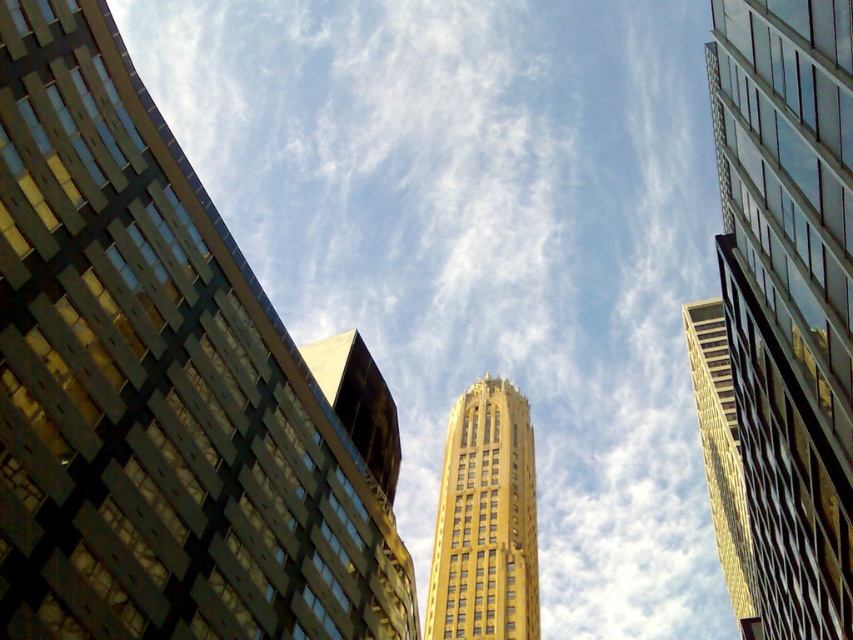
Does gold glass skyscraper at upper center come in front of gold glass skyscraper at center?

Yes.

Which is above, gold glass skyscraper at upper center or gold glass skyscraper at center?

gold glass skyscraper at upper center is higher up.

Where is `gold glass skyscraper at upper center`? The width and height of the screenshot is (853, 640). gold glass skyscraper at upper center is located at coordinates (788, 296).

Identify the location of golden glass skyscraper at center. (160, 387).

Is golden glass skyscraper at center taller than gold glass skyscraper at center?

Yes, golden glass skyscraper at center is taller than gold glass skyscraper at center.

Identify the location of golden glass skyscraper at center. The width and height of the screenshot is (853, 640). (160, 387).

You are a GUI agent. You are given a task and a screenshot of the screen. Output one action in this format:
    pyautogui.click(x=<x>, y=<y>)
    Task: Click on the golden glass skyscraper at center
    
    Given the screenshot: What is the action you would take?
    pyautogui.click(x=160, y=387)

Is point (456, 576) positioned after point (352, 365)?

Yes, point (456, 576) is behind point (352, 365).

Is gold glass tower at center smaller than gold glass skyscraper at center?

Result: No, gold glass tower at center is not smaller than gold glass skyscraper at center.

Between point (492, 554) and point (360, 433), which one is positioned in front?

Point (360, 433)

Image resolution: width=853 pixels, height=640 pixels. In order to click on gold glass tower at center in this screenshot , I will do `click(485, 520)`.